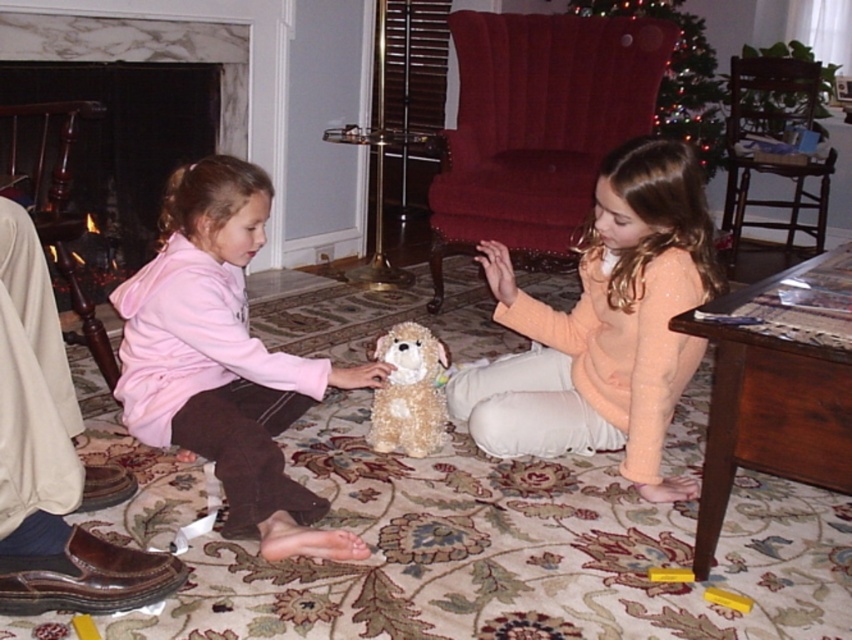
Looking at this image, you are taking a photo of the two points in the scene. Which point, point (505,298) or point (804,224), will appear larger in the photo?

Point (505,298) will appear larger in the photo because it is closer to the camera than point (804,224).

You are setting up a small table between the matte peach sweater at center and the wooden chair at right. Which object should the table be placed closer to if the sweater is wider?

The table should be placed closer to the wooden chair at right because the matte peach sweater at center is wider and requires more space.